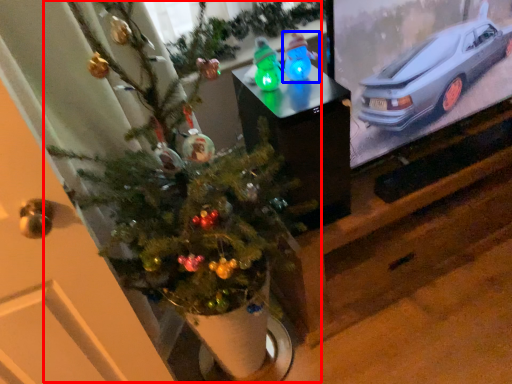
Question: Among these objects, which one is farthest to the camera, christmas tree (highlighted by a red box) or toy (highlighted by a blue box)?

Choices:
 (A) christmas tree
 (B) toy

Answer: (B)